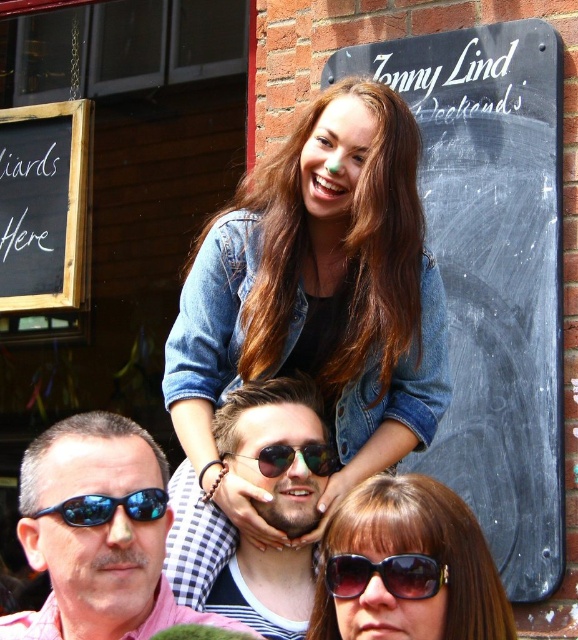
Question: Which of the following is the farthest from the observer?

Choices:
 (A) pink checkered shirt at center
 (B) denim jacket at center

Answer: (B)

Question: Which point is farther from the camera taking this photo?

Choices:
 (A) (554, 561)
 (B) (350, 561)
 (C) (339, 547)
 (D) (424, 291)

Answer: (D)

Question: Can you confirm if shiny metallic sunglasses at center is wider than blue reflective lens sunglasses at lower left?

Choices:
 (A) yes
 (B) no

Answer: (B)

Question: Is matte black sunglasses at lower center in front of shiny silver sunglasses at center?

Choices:
 (A) yes
 (B) no

Answer: (A)

Question: Which object is the closest to the matte black sunglasses at lower center?

Choices:
 (A) black chalkboard at upper right
 (B) shiny silver sunglasses at center
 (C) blue reflective lens sunglasses at lower left

Answer: (B)

Question: Is pink checkered shirt at center smaller than shiny silver sunglasses at center?

Choices:
 (A) no
 (B) yes

Answer: (A)